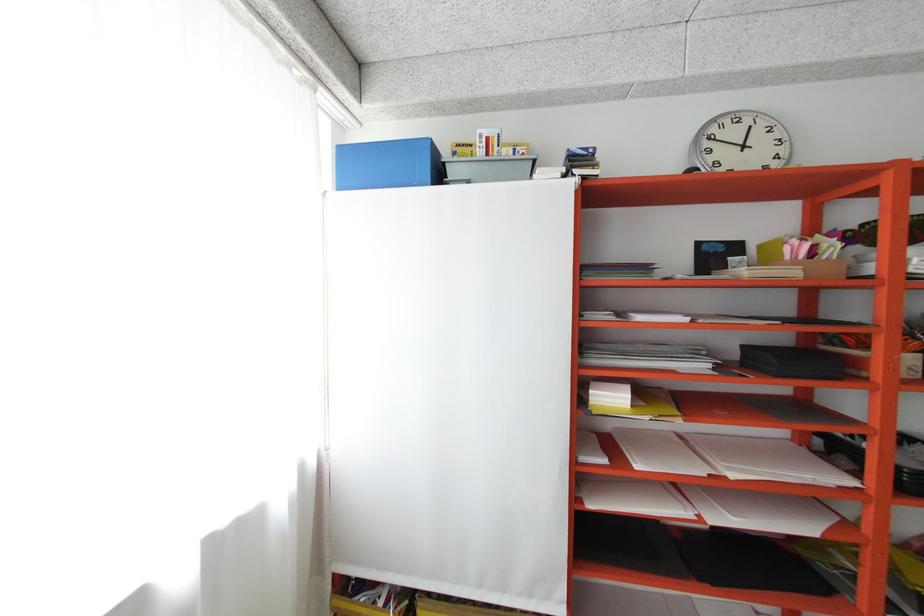
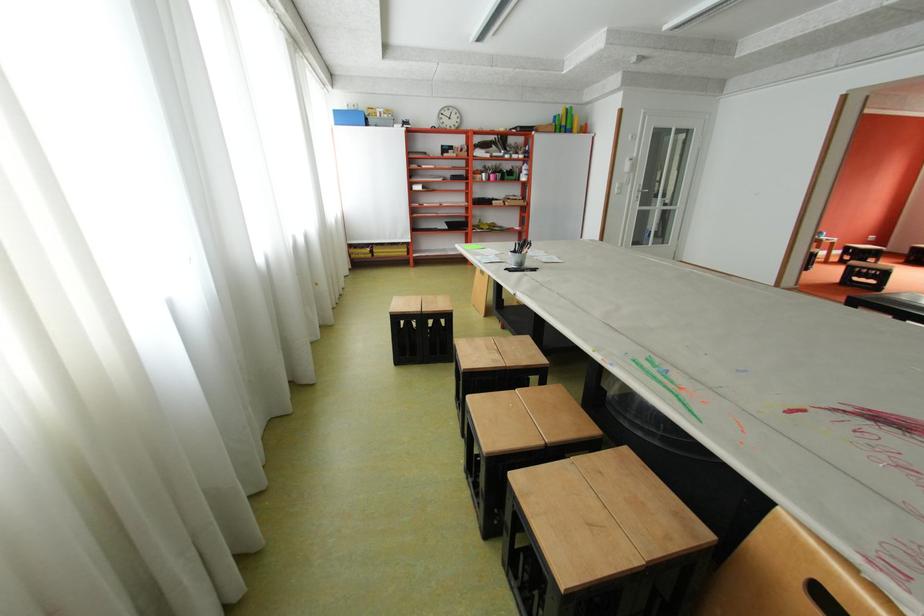
Question: Which direction would the cameraman need to move to produce the second image? Reply with the corresponding letter.

Choices:
 (A) Left
 (B) Right
 (C) Forward
 (D) Backward

Answer: (D)